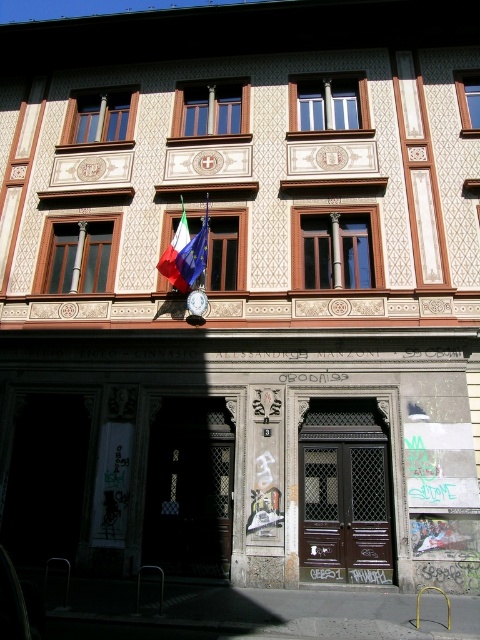
Between brown wood window at upper left and polished metallic flag at center, which one has less height?

polished metallic flag at center

Which is more to the left, brown wood window at upper left or polished metallic flag at center?

From the viewer's perspective, brown wood window at upper left appears more on the left side.

Is point (103, 291) behind point (183, 208)?

No, it is in front of (183, 208).

Find the location of a particular element. The height and width of the screenshot is (640, 480). brown wood window at upper left is located at coordinates (76, 253).

Is point (295, 230) farther from viewer compared to point (204, 120)?

No.

Image resolution: width=480 pixels, height=640 pixels. In order to click on wooden window at center in this screenshot , I will do `click(336, 248)`.

Describe the element at coordinates (327, 104) in the screenshot. I see `white wooden window at center` at that location.

Who is taller, white wooden window at center or polished metallic flag at center?

polished metallic flag at center is taller.

What are the coordinates of `white wooden window at center` in the screenshot? It's located at point(327,104).